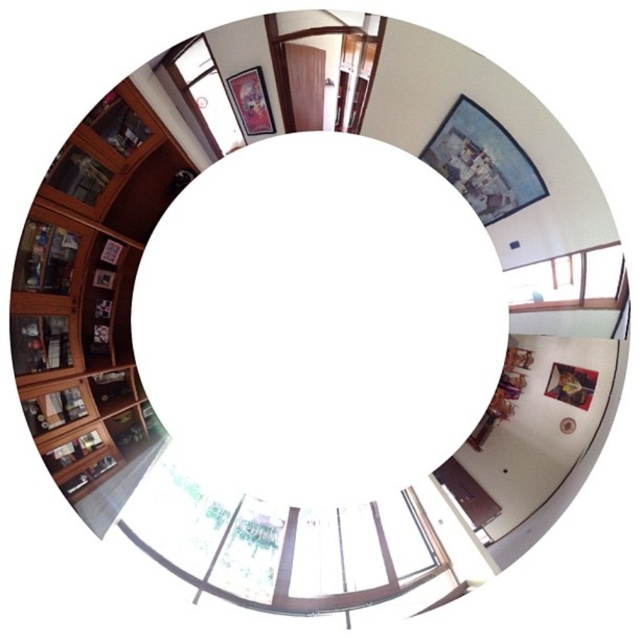
You are standing in the center of the room looking at the image captured with a fisheye lens. The central area is white due to the lens distortion. Where is the wooden bookshelf at left located in relation to your position?

The wooden bookshelf at left is located at coordinates point 0.466 on the x axis and 0.142 on the y axis relative to the center of the image.

From the picture: You are holding a small 10 cm ruler and want to measure the distance from your eyes to the point marked at coordinates point (436, 152) in the image. Based on the information provided, can you determine if the ruler will be sufficient to measure this distance?

The point (436, 152) is 47.48 centimeters away from the viewer. Since the ruler is only 10 centimeters long, it will not be long enough to measure the distance to the point (436, 152).

You are an interior designer assessing the space in the image. You need to determine which object occupies more horizontal space in the room. Based on the scene, which one is wider between the wooden bookshelf at left and the transparent glass window at upper right?

The wooden bookshelf at left is wider than the transparent glass window at upper right according to the description.